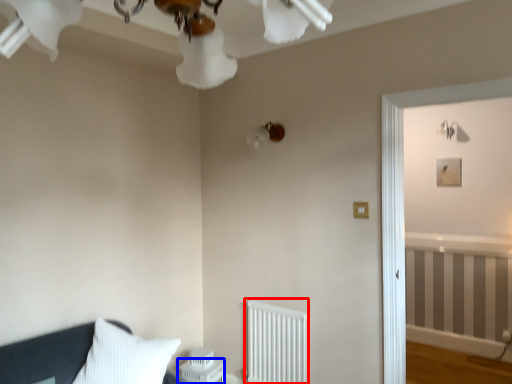
Question: Which point is closer to the camera, radiator (highlighted by a red box) or table (highlighted by a blue box)?

Choices:
 (A) radiator
 (B) table

Answer: (A)